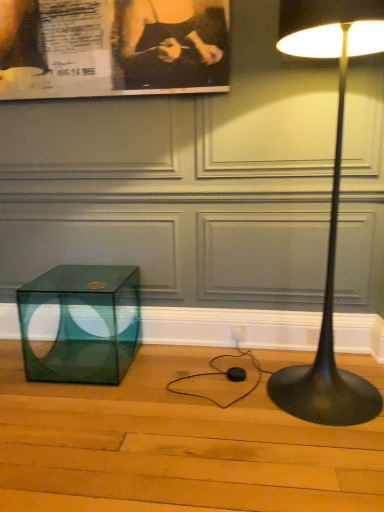
Question: Considering the positions of black paper at upper left and black matte floor lamp at right in the image, is black paper at upper left taller or shorter than black matte floor lamp at right?

Choices:
 (A) short
 (B) tall

Answer: (A)

Question: From the image's perspective, is black paper at upper left located above or below black matte floor lamp at right?

Choices:
 (A) below
 (B) above

Answer: (B)

Question: Based on their relative distances, which object is nearer to the transparent glass cube at lower left?

Choices:
 (A) black paper at upper left
 (B) black matte floor lamp at right

Answer: (A)

Question: Which of these objects is positioned farthest from the black matte floor lamp at right?

Choices:
 (A) transparent glass cube at lower left
 (B) black paper at upper left

Answer: (A)